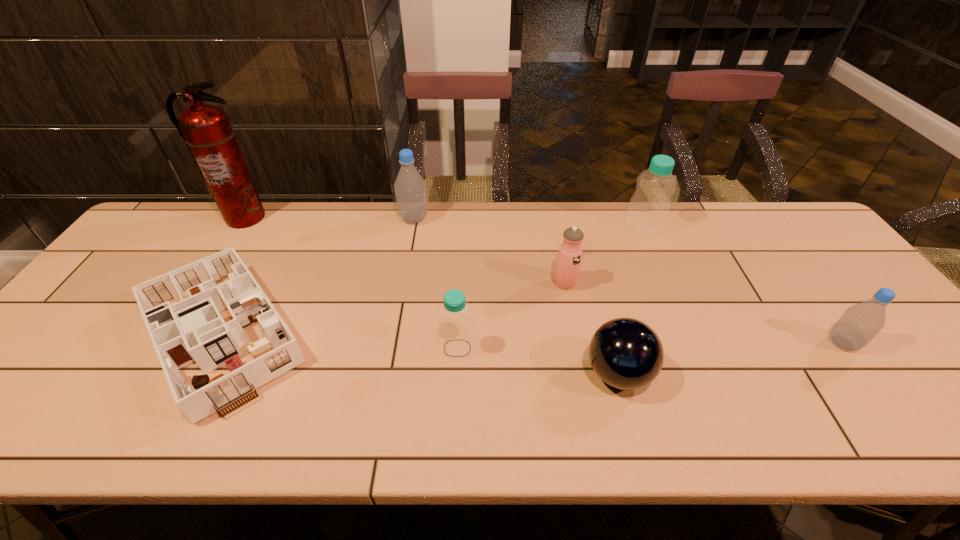
Find the location of a particular element. The image size is (960, 540). vacant space that's between the fifth object from right to left and the farther gray bottle is located at coordinates (436, 284).

Locate an element on the screen. This screenshot has width=960, height=540. blank region between the farther gray bottle and the left blue bottle is located at coordinates (436, 284).

This screenshot has width=960, height=540. Find the location of `unoccupied area between the seventh tallest object and the smaller gray bottle`. unoccupied area between the seventh tallest object and the smaller gray bottle is located at coordinates 731,359.

Identify which object is the sixth closest to the seventh object from left to right. Please provide its 2D coordinates. Your answer should be formatted as a tuple, i.e. [(x, y)], where the tuple contains the x and y coordinates of a point satisfying the conditions above.

[(189, 318)]

The image size is (960, 540). Find the location of `the second closest object relative to the smaller blue bottle`. the second closest object relative to the smaller blue bottle is located at coordinates (569, 257).

Where is `the third closest bottle to the tallest object`? the third closest bottle to the tallest object is located at coordinates (649, 206).

Identify which bottle is the second closest to the thermos bottle. Please provide its 2D coordinates. Your answer should be formatted as a tuple, i.e. [(x, y)], where the tuple contains the x and y coordinates of a point satisfying the conditions above.

[(456, 332)]

Identify the location of vacant space that satisfies the following two spatial constraints: 1. on the front side of the nearer blue bottle; 2. on the right side of the shortest object. (211, 348).

You are a GUI agent. You are given a task and a screenshot of the screen. Output one action in this format:
    pyautogui.click(x=<x>, y=<y>)
    Task: Click on the free space that satisfies the following two spatial constraints: 1. on the nozzle side of the seventh object from left to right; 2. on the left side of the fire extinguisher
    
    Given the screenshot: What is the action you would take?
    pyautogui.click(x=238, y=228)

Image resolution: width=960 pixels, height=540 pixels. I want to click on free space that satisfies the following two spatial constraints: 1. on the front side of the rightmost object; 2. on the left side of the thermos bottle, so click(576, 343).